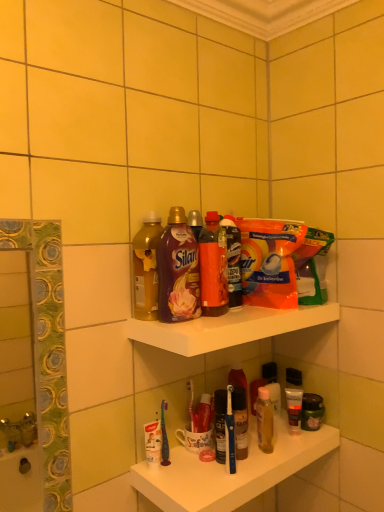
This screenshot has width=384, height=512. I want to click on vacant area to the right of translucent orange bottle at center, the first bottle when ordered from right to left, so click(x=253, y=313).